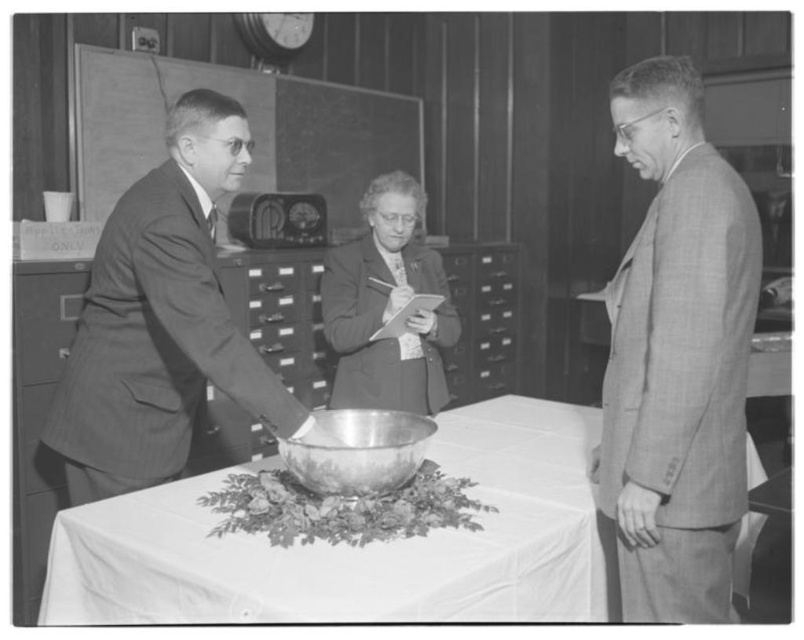
Question: Which point is farther to the camera?

Choices:
 (A) (651, 168)
 (B) (212, 552)
 (C) (134, 474)

Answer: (C)

Question: Is checkered wool suit at right behind smooth suit at left?

Choices:
 (A) no
 (B) yes

Answer: (A)

Question: Which object is the farthest from the checkered wool suit at right?

Choices:
 (A) matte black suit at center
 (B) white cloth at center

Answer: (A)

Question: Is the position of smooth suit at left more distant than that of matte black suit at center?

Choices:
 (A) yes
 (B) no

Answer: (B)

Question: Which point is farther to the camera?

Choices:
 (A) (460, 592)
 (B) (195, 355)

Answer: (B)

Question: Does checkered wool suit at right have a smaller size compared to matte black suit at center?

Choices:
 (A) yes
 (B) no

Answer: (A)